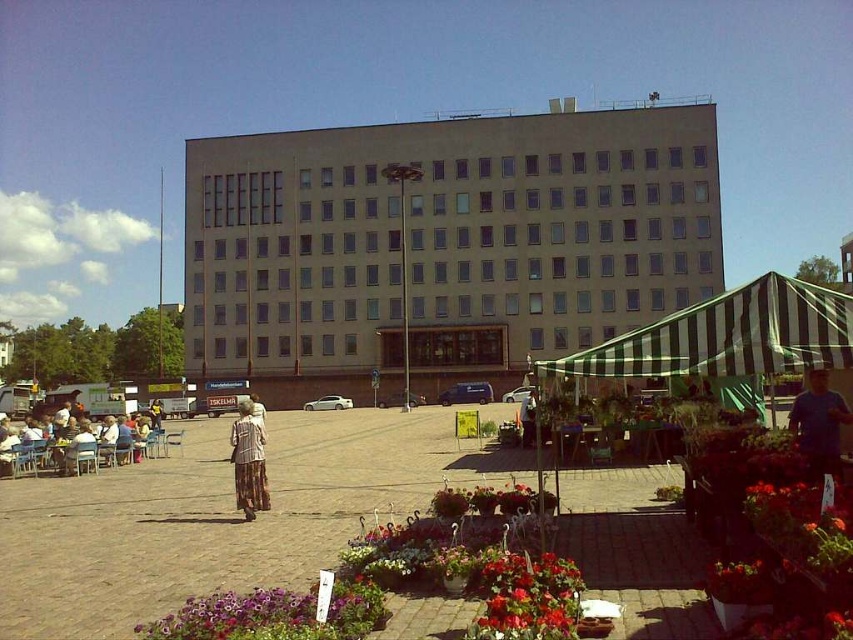
Question: Which point is closer to the camera?

Choices:
 (A) striped shirt at lower left
 (B) green striped canopy at right
 (C) purple matte flower at lower center

Answer: (C)

Question: Is striped shirt at lower left behind light brown textured pants at center?

Choices:
 (A) no
 (B) yes

Answer: (B)

Question: Which point is closer to the camera?

Choices:
 (A) beige concrete building at center
 (B) light brown textured pants at center
 (C) green striped canopy at right

Answer: (C)

Question: Among these points, which one is nearest to the camera?

Choices:
 (A) (805, 461)
 (B) (247, 451)

Answer: (A)

Question: Is green striped canopy at right positioned in front of striped shirt at lower left?

Choices:
 (A) yes
 (B) no

Answer: (A)

Question: Does beige concrete building at center have a larger size compared to purple matte flower at lower center?

Choices:
 (A) no
 (B) yes

Answer: (B)